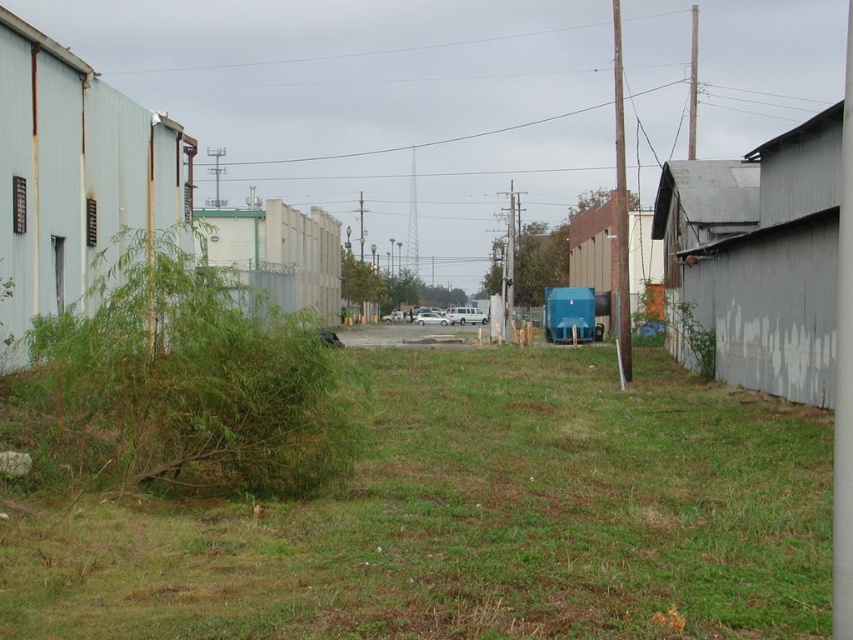
You are a delivery driver who needs to park your white matte van at center in the urban industrial area. The green grassy area at center is uneven and unstable. Can you safely park your van on the green grassy at center without damaging it?

The green grassy at center occupies less space than the white matte van at center, so it is not large enough to accommodate the van. Therefore, parking the white matte van at center on the green grassy at center would likely cause damage due to insufficient space and the unstable ground.

You are a delivery driver who needs to park your white matte van at center on the grassy area. Is the green grassy at center a suitable spot for parking?

The green grassy at center is positioned under white matte van at center, so parking the white matte van at center on the grassy area would not be suitable as the van is already occupying that space.

You are standing at the origin point of the coordinate system in the urban industrial area. You need to reach the green grassy at center. What are the coordinates you should move towards?

The coordinates to move towards are 0.814 in the x direction and 0.557 in the y direction.